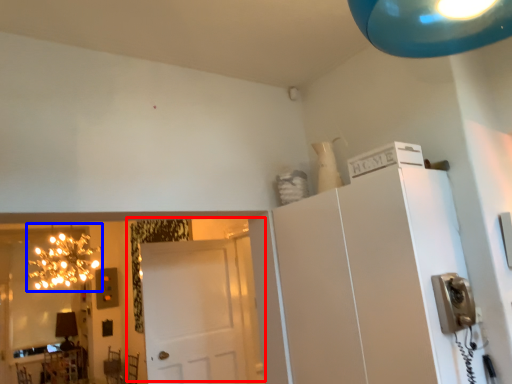
Question: Which point is closer to the camera, door (highlighted by a red box) or light fixture (highlighted by a blue box)?

Choices:
 (A) door
 (B) light fixture

Answer: (A)